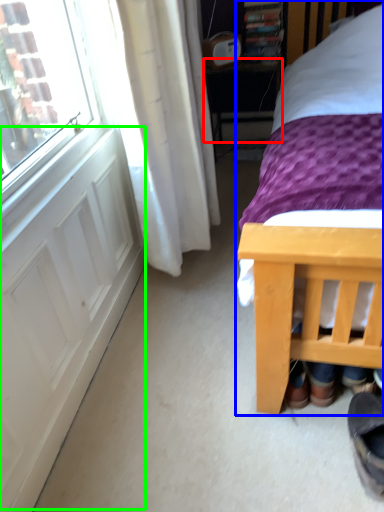
Question: Which is farther away from table (highlighted by a red box)? bed (highlighted by a blue box) or screen door (highlighted by a green box)?

Choices:
 (A) bed
 (B) screen door

Answer: (A)